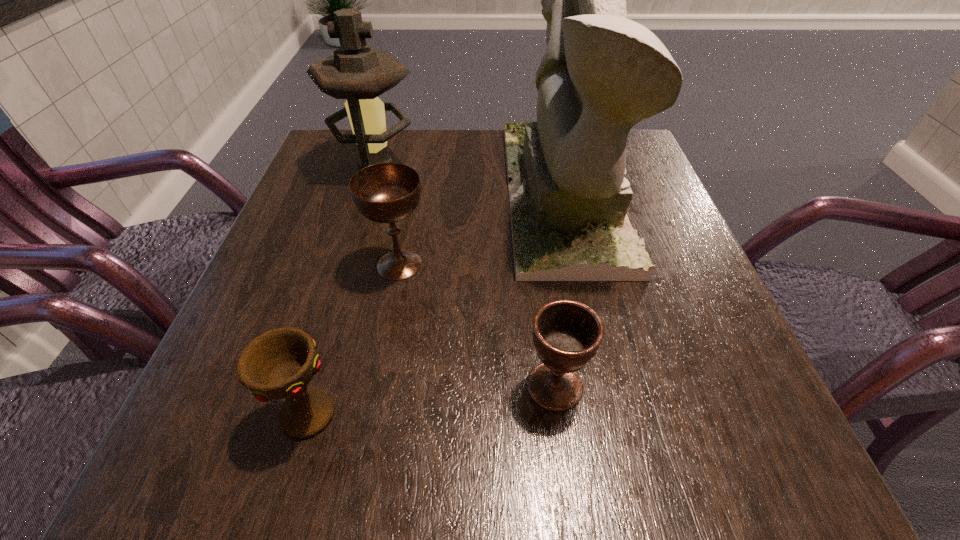
Where is `sculpture`? sculpture is located at coordinates (601, 73).

At what (x,y) coordinates should I click in order to perform the action: click on the fourth shortest object. Please return your answer as a coordinate pair (x, y). This screenshot has width=960, height=540. Looking at the image, I should click on (356, 72).

The height and width of the screenshot is (540, 960). What are the coordinates of `the farthest chalice` in the screenshot? It's located at (386, 192).

Locate an element on the screen. The image size is (960, 540). the third shortest object is located at coordinates (386, 192).

Image resolution: width=960 pixels, height=540 pixels. What are the coordinates of `the rightmost chalice` in the screenshot? It's located at (567, 334).

The image size is (960, 540). I want to click on vacant space located 0.240m on the base of the tallest object, so click(x=396, y=194).

This screenshot has width=960, height=540. Identify the location of vacant area situated 0.110m on the base of the tallest object. (457, 194).

The width and height of the screenshot is (960, 540). Find the location of `vacant space located on the base of the tallest object`. vacant space located on the base of the tallest object is located at coordinates (400, 194).

I want to click on vacant region located on the right of the fourth shortest object, so click(x=468, y=167).

This screenshot has height=540, width=960. In order to click on free region located on the front of the third shortest object in this screenshot , I will do (372, 420).